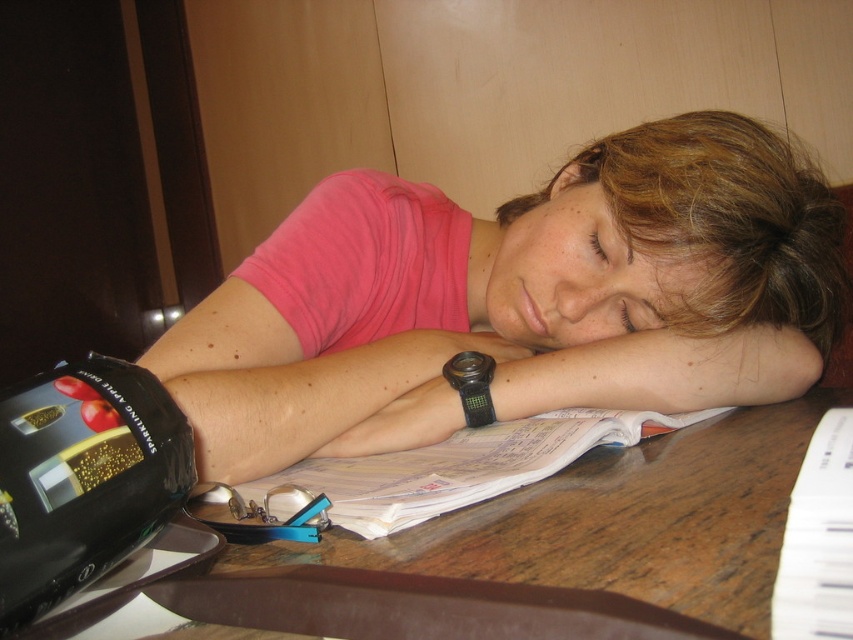
You are standing in front of the desk and want to place a small object on the desk. You have two options for placement points. The first point is at coordinates point (352,284) and the second is at point (625,145). Which point is closer to you?

Point (352,284) is closer to the viewer than point (625,145).

You are a photographer aiming to capture a closeup of the pink fabric shirt at center. Given that your camera has a focal length of 50mm and you want to maintain a sharp focus on the shirt, what is the minimum distance you should position your camera from the shirt to ensure clarity?

To determine the minimum distance for sharp focus, apply the lens formula 1 focal length equals 1 object distance plus 1 image distance. With a 50mm focal length, the shirt must be at least twice the focal length away from the lens, so the minimum distance should be 100mm.

You are a photographer standing in front of the desk. You need to capture a photo where both the pink fabric shirt at center and the brown hair at center are clearly visible. Based on their sizes, which object should you focus on first to ensure proper framing?

The pink fabric shirt at center has a greater height compared to the brown hair at center, so you should focus on the pink fabric shirt at center first to ensure proper framing.